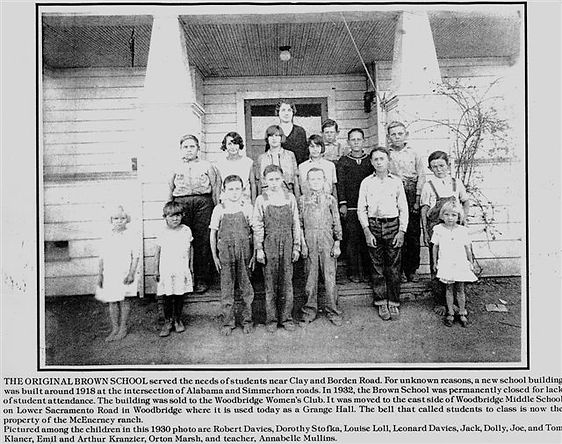
This screenshot has height=444, width=562. Find the location of `window`. window is located at coordinates (317, 124).